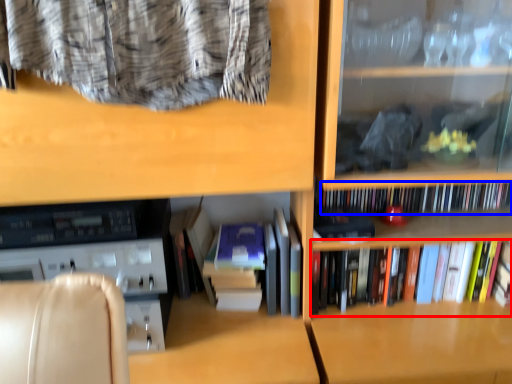
Question: Which point is closer to the camera, book (highlighted by a red box) or book (highlighted by a blue box)?

Choices:
 (A) book
 (B) book

Answer: (A)